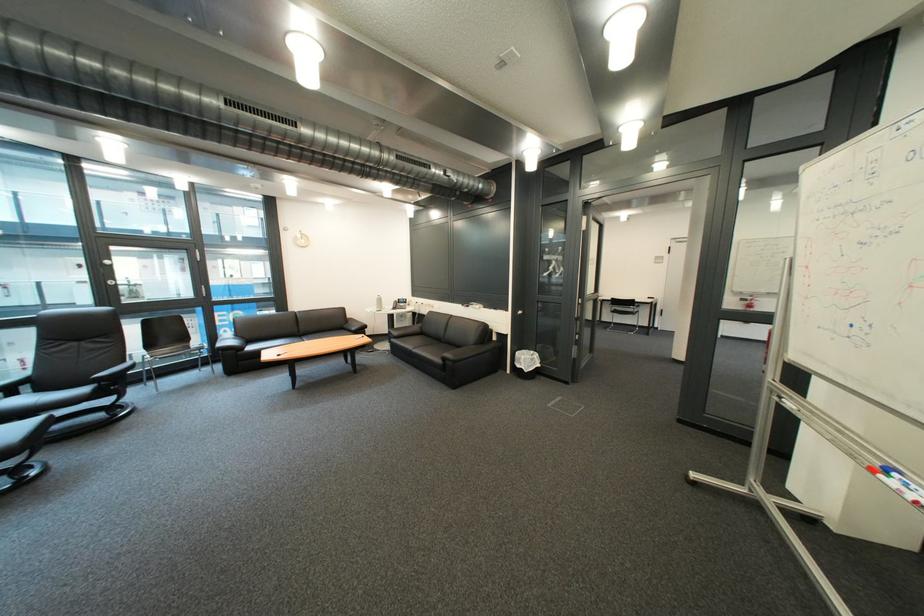
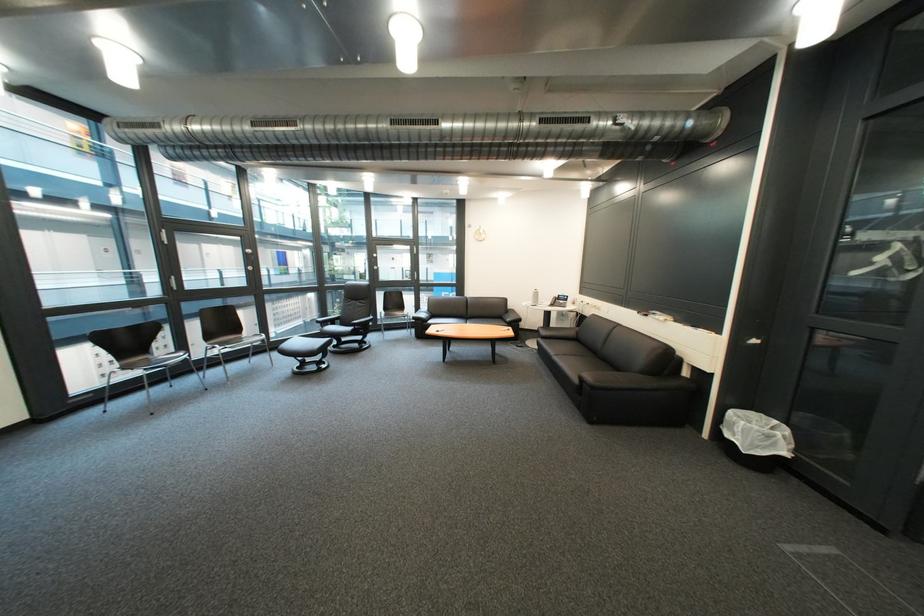
The point at (234, 346) is marked in the first image. Where is the corresponding point in the second image?

(430, 317)